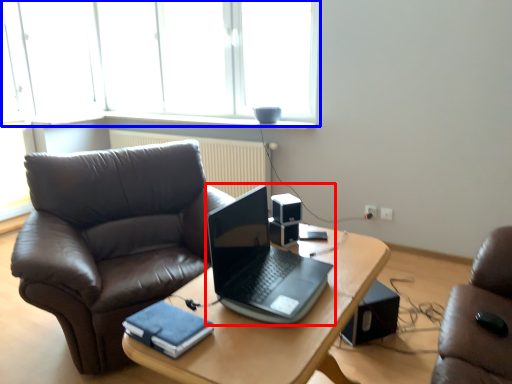
Question: Which object is further to the camera taking this photo, laptop (highlighted by a red box) or window (highlighted by a blue box)?

Choices:
 (A) laptop
 (B) window

Answer: (B)